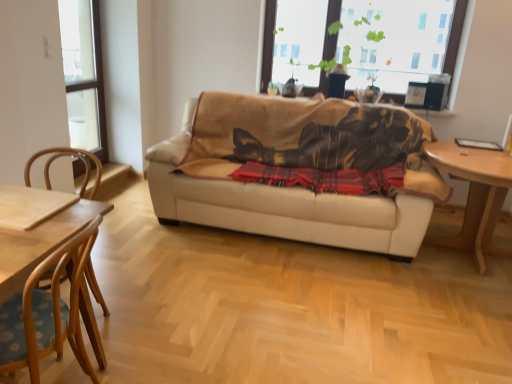
This screenshot has width=512, height=384. I want to click on vacant area on the back side of light wood chair at left, the 2th chair in the front-to-back sequence, so click(124, 275).